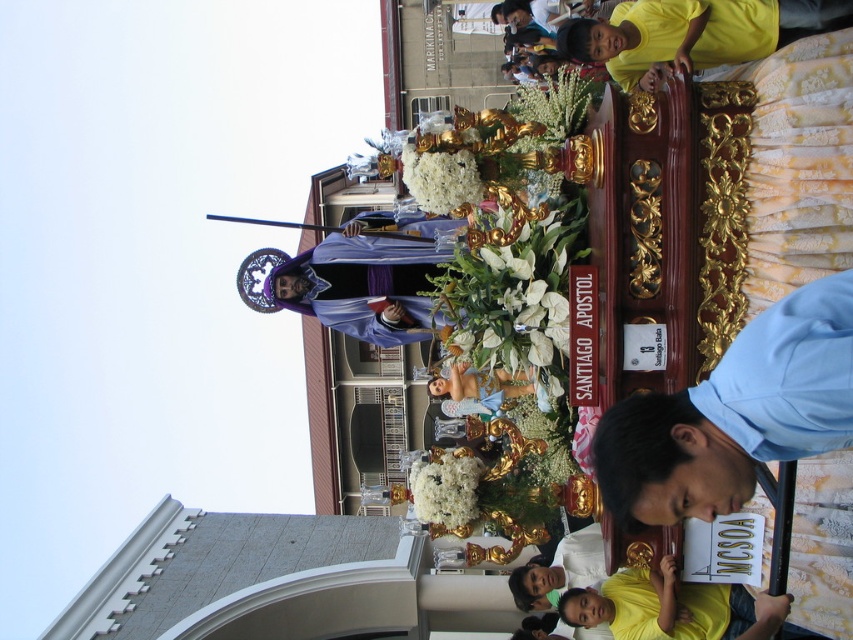
You are standing in the crowd watching the religious procession. You see the purple velvet robe at center and the yellow matte shirt at lower right. Which one is closer to you?

The purple velvet robe at center is closer to you because it is further to the viewer than the yellow matte shirt at lower right.

In the scene shown: You are a photographer at the event and want to capture both the light blue shirt at lower right and the yellow matte shirt at lower right in a single frame. Based on their positions, which shirt should you focus on first to ensure both are in the photo?

The light blue shirt at lower right is located above the yellow matte shirt at lower right, so focusing on the light blue shirt at lower right first will ensure both are in the frame.